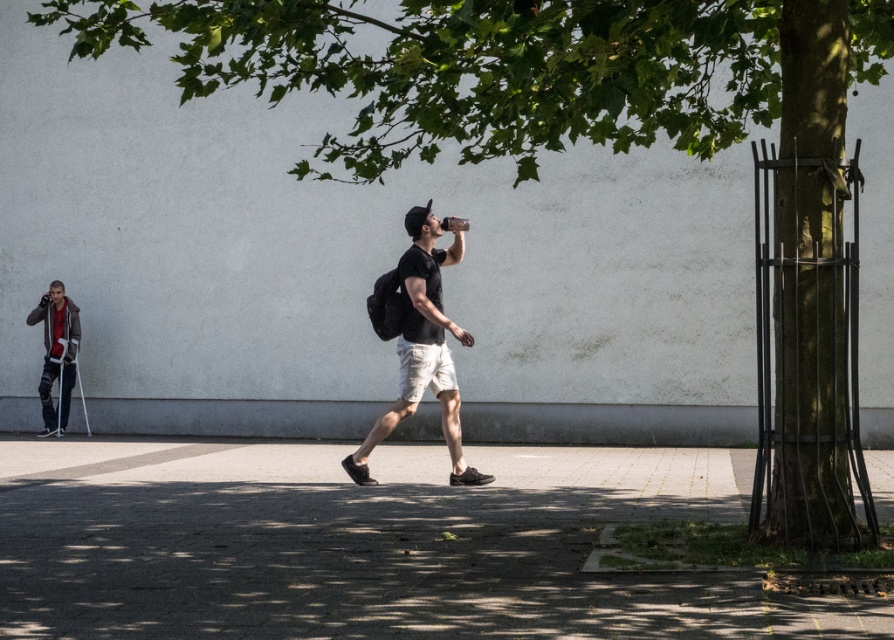
Based on the photo, how much distance is there between gray concrete pavement at center and matte black backpack at center?

gray concrete pavement at center and matte black backpack at center are 5.84 feet apart.

Is point (300, 609) positioned after point (456, 483)?

That is False.

Where is `gray concrete pavement at center`? gray concrete pavement at center is located at coordinates (372, 545).